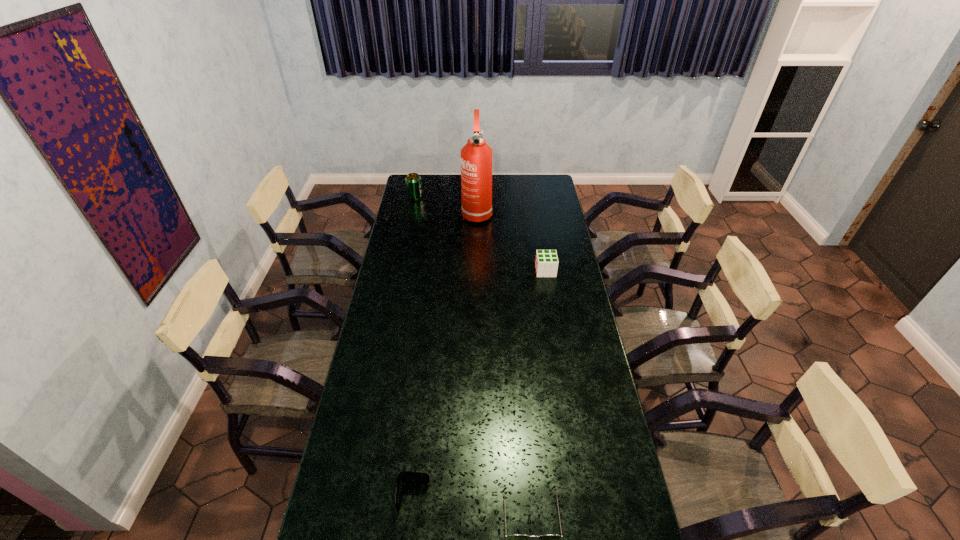
Identify the location of free region located 0.310m on the red face of the third tallest object. This screenshot has height=540, width=960. (468, 271).

Image resolution: width=960 pixels, height=540 pixels. Identify the location of free space located 0.320m on the red face of the third tallest object. (466, 271).

Locate an element on the screen. Image resolution: width=960 pixels, height=540 pixels. blank space located on the red face of the third tallest object is located at coordinates (500, 271).

The height and width of the screenshot is (540, 960). I want to click on vacant area situated on the outer surface of the fourth object from right to left, so click(x=410, y=534).

Identify the location of object that is at the far edge. (412, 180).

Where is `object that is at the left edge`? Image resolution: width=960 pixels, height=540 pixels. object that is at the left edge is located at coordinates (412, 180).

Find the location of a particular element. The width and height of the screenshot is (960, 540). object that is at the right edge is located at coordinates (546, 263).

Find the location of a particular element. object that is at the far left corner is located at coordinates (412, 180).

The height and width of the screenshot is (540, 960). I want to click on vacant space at the far edge of the desktop, so click(x=442, y=174).

Where is `free spot at the left edge of the desktop`? free spot at the left edge of the desktop is located at coordinates (402, 310).